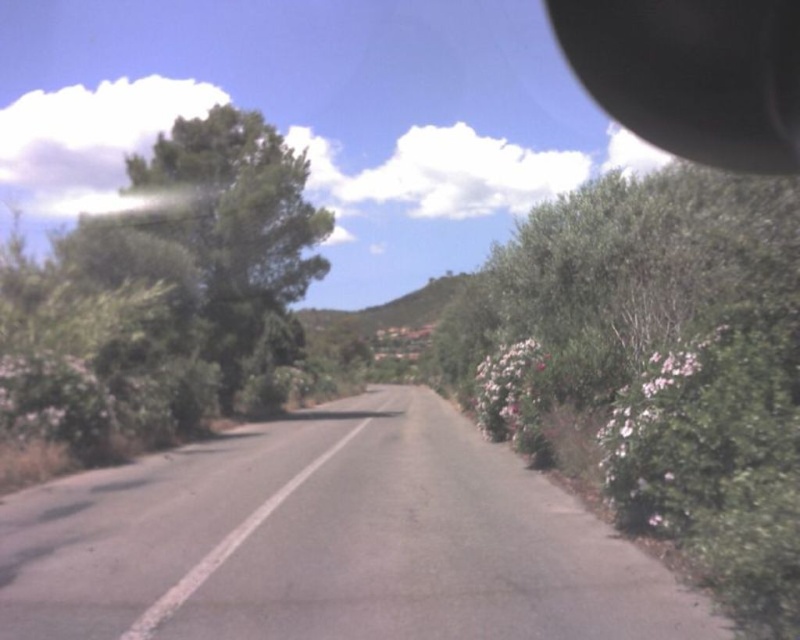
Question: Which is nearer to the black rubber view mirror at upper right?

Choices:
 (A) green leafy bush at right
 (B) white matte flowers at right
 (C) pink fluffy bush at right

Answer: (B)

Question: From the image, what is the correct spatial relationship of green leafy bush at right in relation to green leafy tree at left?

Choices:
 (A) below
 (B) above

Answer: (A)

Question: Considering the relative positions of green leafy tree at left and white matte flowers at right in the image provided, where is green leafy tree at left located with respect to white matte flowers at right?

Choices:
 (A) below
 (B) above

Answer: (B)

Question: Which point is closer to the camera?

Choices:
 (A) (770, 72)
 (B) (649, 374)
 (C) (600, 454)
 (D) (508, 349)

Answer: (B)

Question: Estimate the real-world distances between objects in this image. Which object is closer to the white matte flowers at right?

Choices:
 (A) green leafy tree at left
 (B) green leafy bush at right
 (C) pink fluffy bush at right

Answer: (B)

Question: Is white matte flowers at right closer to camera compared to pink fluffy bush at right?

Choices:
 (A) yes
 (B) no

Answer: (A)